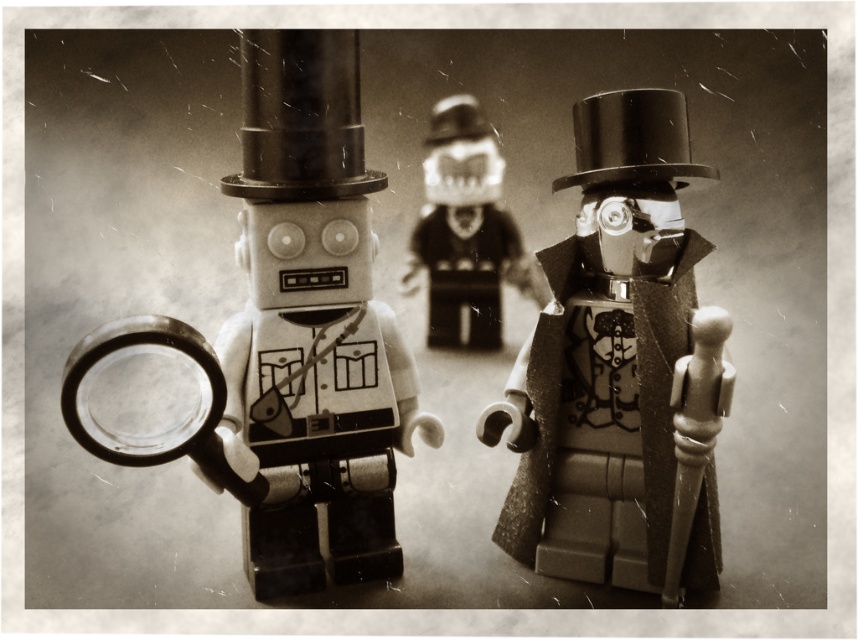
You are a photographer standing at a distance of 30 inches from the LEGO scene. You want to focus your camera on the matte black top hat at center. Will the hat be in focus if your camera has a depth of field that can clearly capture objects within 32 inches from the lens?

The matte black top hat at center is 34.25 inches from the viewer, which is beyond the camera lens depth of field limit of 32 inches. Therefore, the hat will not be in focus.

You are a photographer adjusting your camera to focus on two points in the image. The first point is at coordinates point (663,234) and the second is at point (201,337). Which point should you focus on first if you want to capture the closest object to the camera?

Point (663,234) is further to the camera than point (201,337). Therefore, you should focus on point (663,234) first as it is closer to the camera.